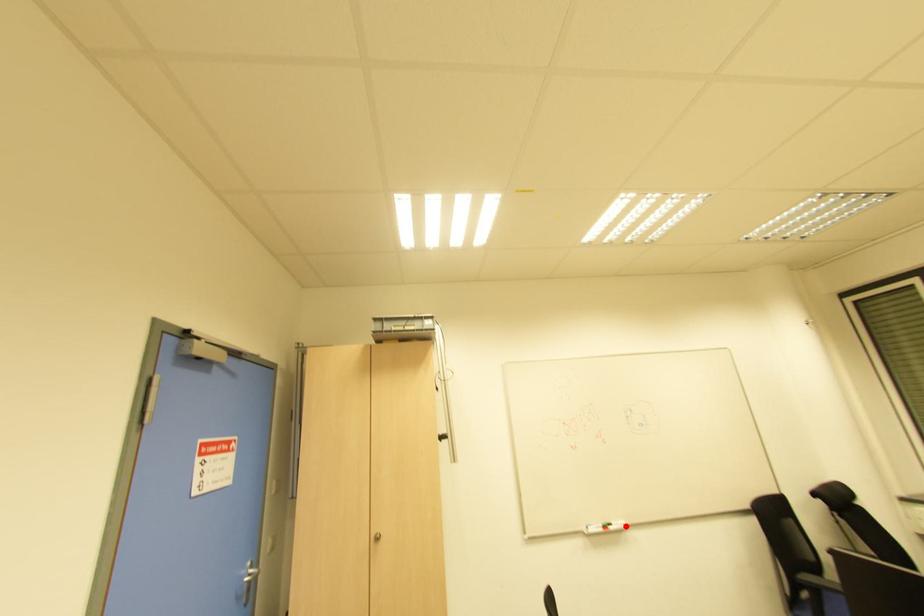
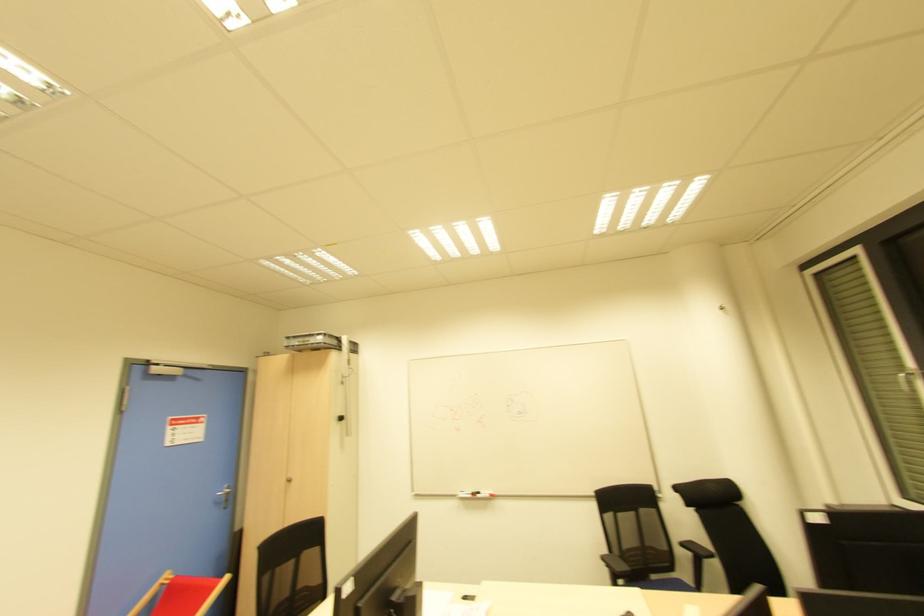
Where in the second image is the point corresponding to the highlighted location from the first image?

(492, 496)